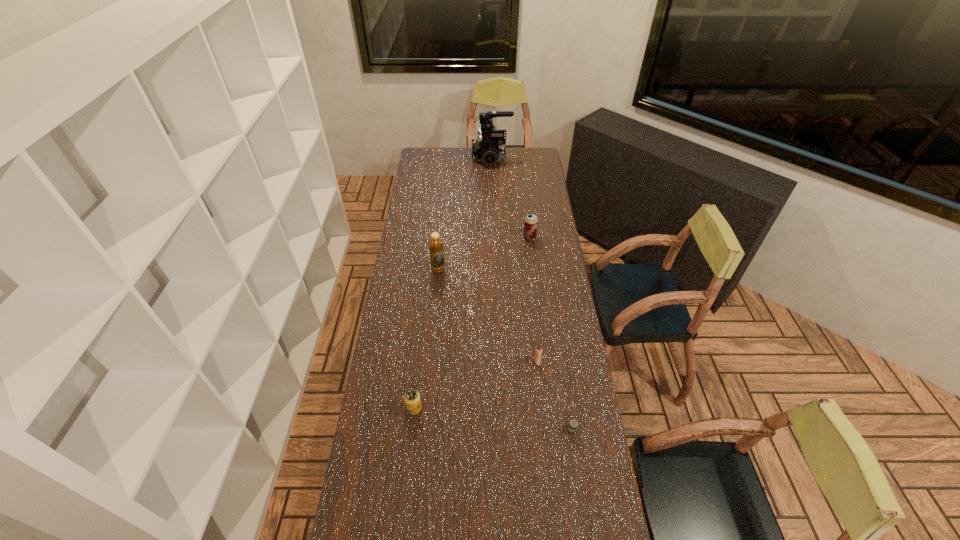
Where is `the tallest object`? the tallest object is located at coordinates (489, 148).

The image size is (960, 540). What are the coordinates of `camcorder` in the screenshot? It's located at (489, 148).

The height and width of the screenshot is (540, 960). I want to click on the third farthest object, so click(x=435, y=243).

The image size is (960, 540). In order to click on the fifth shortest object in this screenshot , I will do `click(435, 243)`.

Locate an element on the screen. This screenshot has width=960, height=540. the farthest beer can is located at coordinates (531, 221).

You are a GUI agent. You are given a task and a screenshot of the screen. Output one action in this format:
    pyautogui.click(x=<x>, y=<y>)
    Task: Click on the tallest beer can
    
    Given the screenshot: What is the action you would take?
    531,221

Identify the location of the leftmost beer can. (412, 400).

Where is `igniter`? The height and width of the screenshot is (540, 960). igniter is located at coordinates (538, 351).

Find the location of a particular element. This screenshot has height=540, width=960. the shortest object is located at coordinates (573, 424).

The height and width of the screenshot is (540, 960). Find the location of `vacant region located on the lens mount of the tallest object`. vacant region located on the lens mount of the tallest object is located at coordinates (433, 157).